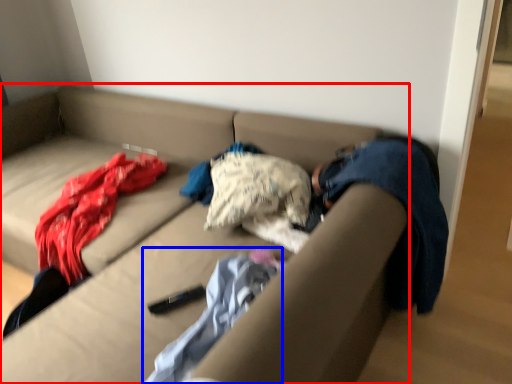
Question: Which object is closer to the camera taking this photo, studio couch (highlighted by a red box) or blanket (highlighted by a blue box)?

Choices:
 (A) studio couch
 (B) blanket

Answer: (A)